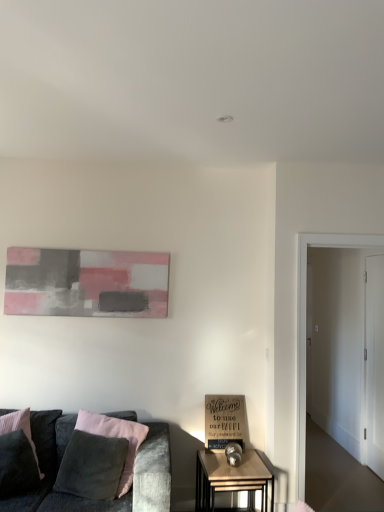
Question: Could white glossy door at right, placed as the first glass door when sorted from back to front, be considered to be inside white glossy door at right, marked as the 2th glass door in a back-to-front arrangement?

Choices:
 (A) yes
 (B) no

Answer: (B)

Question: Can you confirm if white glossy door at right, marked as the 2th glass door in a back-to-front arrangement, is taller than white glossy door at right, the second glass door viewed from the front?

Choices:
 (A) no
 (B) yes

Answer: (B)

Question: From the image's perspective, is white glossy door at right, which ranks as the first glass door in front-to-back order, located above white glossy door at right, placed as the first glass door when sorted from back to front?

Choices:
 (A) yes
 (B) no

Answer: (A)

Question: Considering the relative sizes of white glossy door at right, placed as the 2th glass door when sorted from right to left, and white glossy door at right, placed as the first glass door when sorted from back to front, in the image provided, is white glossy door at right, placed as the 2th glass door when sorted from right to left, thinner than white glossy door at right, placed as the first glass door when sorted from back to front,?

Choices:
 (A) yes
 (B) no

Answer: (B)

Question: From a real-world perspective, is white glossy door at right, marked as the first glass door in a left-to-right arrangement, physically above white glossy door at right, which is the first glass door in right-to-left order?

Choices:
 (A) no
 (B) yes

Answer: (B)

Question: From a real-world perspective, is dark gray fabric pillow at lower left above or below abstract painting at upper left?

Choices:
 (A) below
 (B) above

Answer: (A)

Question: Is dark gray fabric pillow at lower left wider or thinner than abstract painting at upper left?

Choices:
 (A) wide
 (B) thin

Answer: (A)

Question: Would you say dark gray fabric pillow at lower left is to the left or to the right of abstract painting at upper left in the picture?

Choices:
 (A) right
 (B) left

Answer: (B)

Question: Relative to abstract painting at upper left, is dark gray fabric pillow at lower left in front or behind?

Choices:
 (A) behind
 (B) front

Answer: (B)

Question: In terms of height, does white glossy door at right, which ranks as the first glass door in front-to-back order, look taller or shorter compared to dark gray fabric pillow at lower left?

Choices:
 (A) short
 (B) tall

Answer: (B)

Question: In the image, is white glossy door at right, marked as the first glass door in a left-to-right arrangement, positioned in front of or behind dark gray fabric pillow at lower left?

Choices:
 (A) behind
 (B) front

Answer: (A)

Question: Which is correct: white glossy door at right, marked as the first glass door in a left-to-right arrangement, is inside dark gray fabric pillow at lower left, or outside of it?

Choices:
 (A) inside
 (B) outside

Answer: (B)

Question: Is point (297, 421) closer or farther from the camera than point (28, 421)?

Choices:
 (A) closer
 (B) farther

Answer: (B)

Question: Is velvet grey couch at lower left inside or outside of abstract painting at upper left?

Choices:
 (A) inside
 (B) outside

Answer: (B)

Question: Is point click(61, 500) positioned closer to the camera than point click(52, 301)?

Choices:
 (A) farther
 (B) closer

Answer: (B)